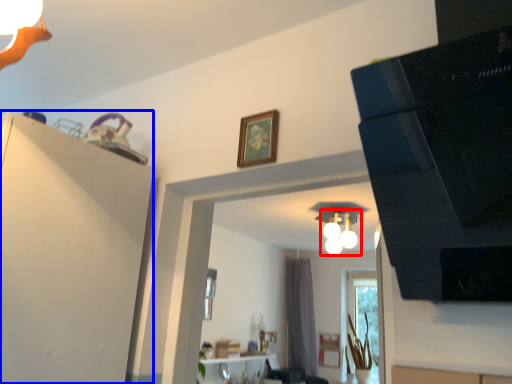
Question: Which object appears farthest to the camera in this image, light fixture (highlighted by a red box) or dresser (highlighted by a blue box)?

Choices:
 (A) light fixture
 (B) dresser

Answer: (A)